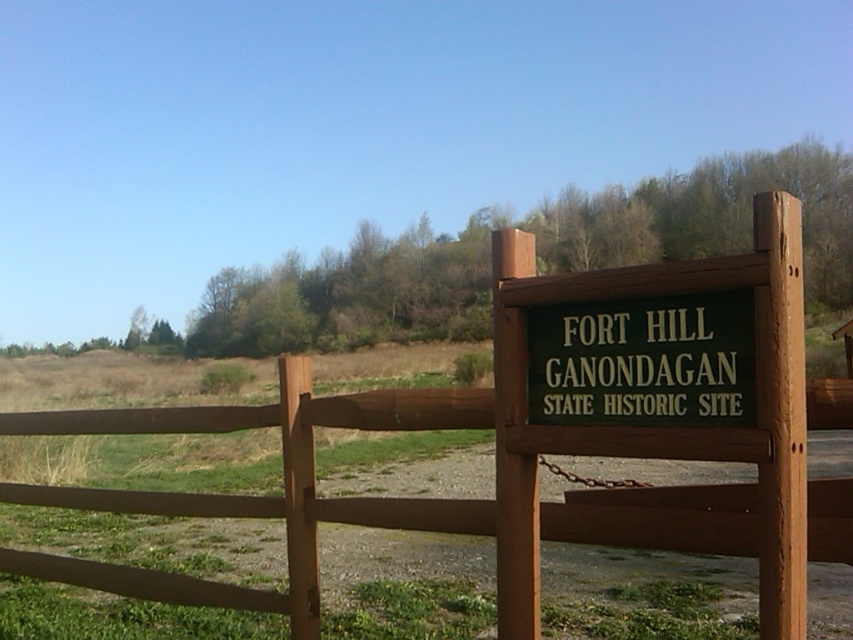
Question: Which point is closer to the camera taking this photo?

Choices:
 (A) (781, 262)
 (B) (746, 284)

Answer: (A)

Question: Does brown wooden fence at center have a smaller size compared to green painted wood sign at right?

Choices:
 (A) yes
 (B) no

Answer: (B)

Question: Which of the following is the farthest from the observer?

Choices:
 (A) (202, 589)
 (B) (779, 336)

Answer: (A)

Question: Does brown wooden fence at center have a larger size compared to green painted wood sign at right?

Choices:
 (A) no
 (B) yes

Answer: (B)

Question: Is brown wooden fence at center below green painted wood sign at right?

Choices:
 (A) yes
 (B) no

Answer: (A)